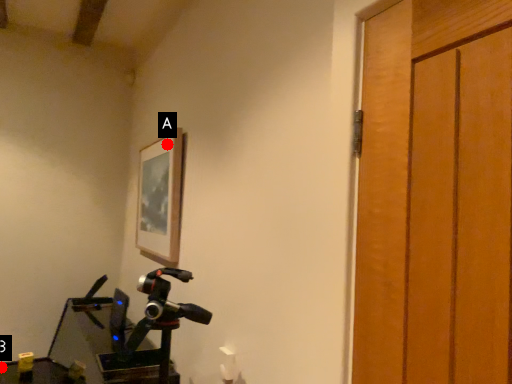
Question: Two points are circled on the image, labeled by A and B beside each circle. Which point appears farthest from the camera in this image?

Choices:
 (A) A is further
 (B) B is further

Answer: (B)